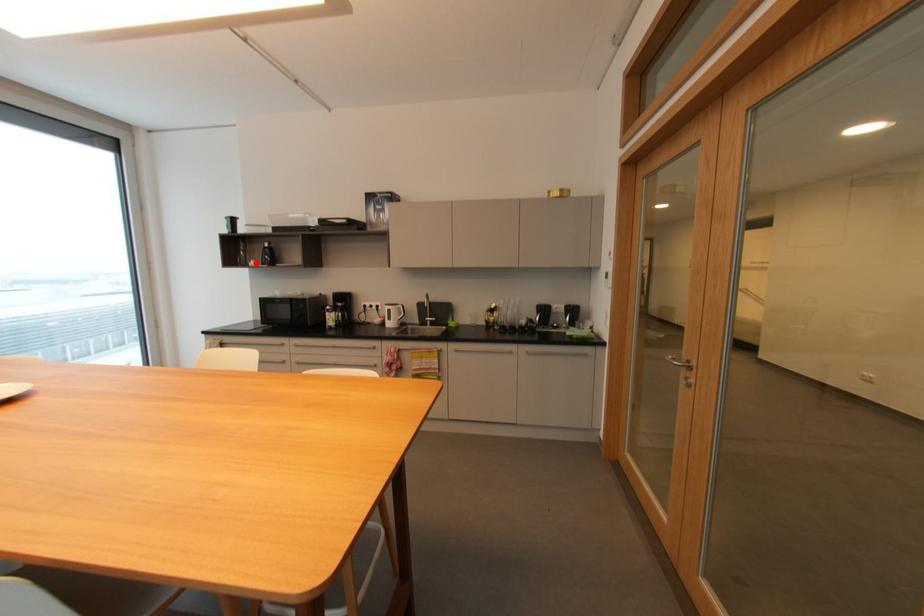
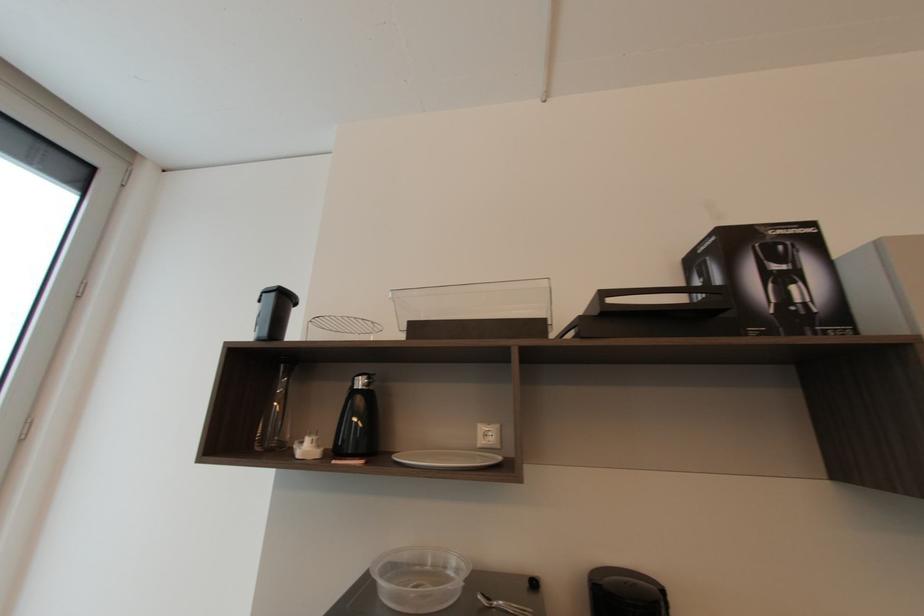
Where in the second image is the point corresponding to the highlighted location from the first image?

(310, 447)